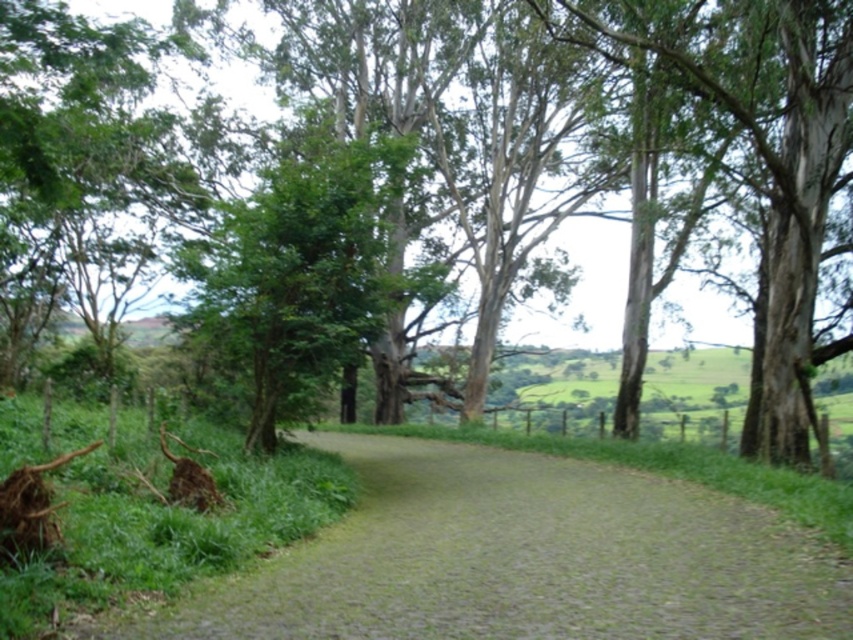
Does dirt/gravel path at center have a larger size compared to green leafy tree at center?

Actually, dirt/gravel path at center might be smaller than green leafy tree at center.

Does dirt/gravel path at center have a greater height compared to green leafy tree at center?

Incorrect, dirt/gravel path at center's height is not larger of green leafy tree at center's.

Is point (509, 525) less distant than point (641, 68)?

Yes, point (509, 525) is closer to viewer.

This screenshot has width=853, height=640. What are the coordinates of `dirt/gravel path at center` in the screenshot? It's located at (521, 557).